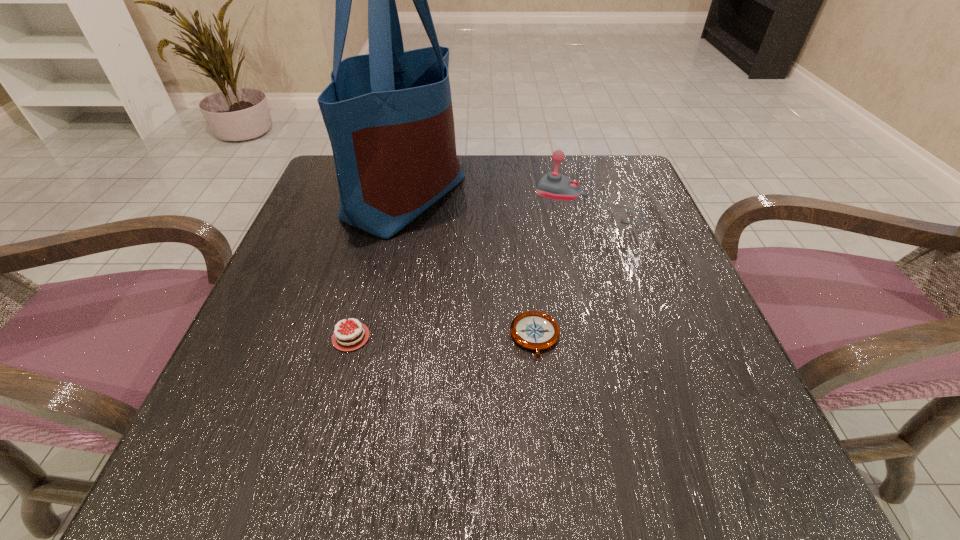
This screenshot has width=960, height=540. I want to click on handbag present at the left edge, so click(389, 116).

Locate an element on the screen. Image resolution: width=960 pixels, height=540 pixels. chocolate cake that is at the left edge is located at coordinates (342, 342).

The image size is (960, 540). I want to click on object present at the right edge, so click(554, 185).

The width and height of the screenshot is (960, 540). In order to click on object that is positioned at the far left corner in this screenshot , I will do `click(389, 116)`.

Image resolution: width=960 pixels, height=540 pixels. Find the location of `object present at the far right corner`. object present at the far right corner is located at coordinates (554, 185).

You are a GUI agent. You are given a task and a screenshot of the screen. Output one action in this format:
    pyautogui.click(x=<x>, y=<y>)
    Task: Click on the vacant space at the far edge of the desktop
    Image resolution: width=960 pixels, height=540 pixels.
    Given the screenshot: What is the action you would take?
    pyautogui.click(x=511, y=164)

The width and height of the screenshot is (960, 540). Identify the location of free location at the near edge. (586, 486).

This screenshot has width=960, height=540. What are the coordinates of `vacant space at the left edge of the desktop` in the screenshot? It's located at (348, 243).

Where is `vacant space at the right edge`? The height and width of the screenshot is (540, 960). vacant space at the right edge is located at coordinates (638, 339).

Locate an element on the screen. vacant area at the near left corner is located at coordinates (305, 430).